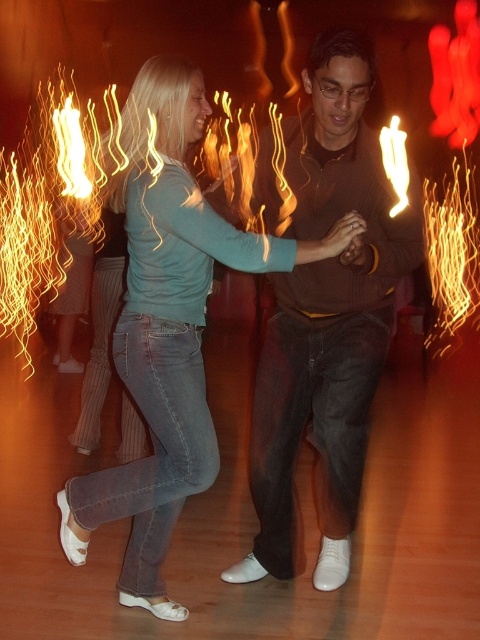
Which is above, dark brown sweater at center or matte teal shirt at center?

dark brown sweater at center

Is dark brown sweater at center above matte teal shirt at center?

Yes.

Which is behind, point (308, 186) or point (216, 214)?

The point (308, 186) is behind.

Locate an element on the screen. The image size is (480, 640). dark brown sweater at center is located at coordinates (325, 317).